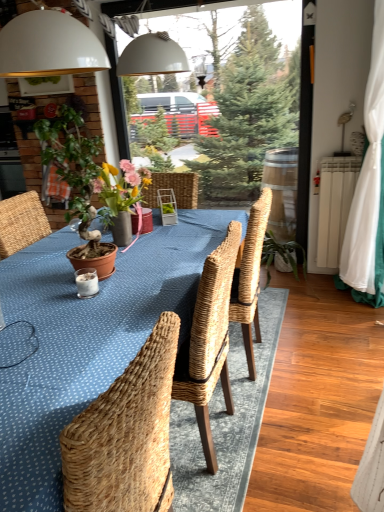
Question: Can you confirm if blue woven table at center is taller than white fabric curtain at right?

Choices:
 (A) yes
 (B) no

Answer: (B)

Question: Considering the relative sizes of blue woven table at center and white fabric curtain at right in the image provided, is blue woven table at center shorter than white fabric curtain at right?

Choices:
 (A) no
 (B) yes

Answer: (B)

Question: From the image's perspective, is blue woven table at center under white fabric curtain at right?

Choices:
 (A) no
 (B) yes

Answer: (B)

Question: Considering the relative sizes of blue woven table at center and white fabric curtain at right in the image provided, is blue woven table at center thinner than white fabric curtain at right?

Choices:
 (A) yes
 (B) no

Answer: (B)

Question: From the image's perspective, would you say blue woven table at center is positioned over white fabric curtain at right?

Choices:
 (A) no
 (B) yes

Answer: (A)

Question: Is blue woven table at center bigger than white fabric curtain at right?

Choices:
 (A) yes
 (B) no

Answer: (A)

Question: Is white fabric curtain at right facing towards blue woven table at center?

Choices:
 (A) no
 (B) yes

Answer: (A)

Question: From a real-world perspective, is white fabric curtain at right over blue woven table at center?

Choices:
 (A) yes
 (B) no

Answer: (A)

Question: Can you confirm if white fabric curtain at right is taller than blue woven table at center?

Choices:
 (A) no
 (B) yes

Answer: (B)

Question: Would you say white fabric curtain at right contains blue woven table at center?

Choices:
 (A) yes
 (B) no

Answer: (B)

Question: Considering the relative sizes of white fabric curtain at right and blue woven table at center in the image provided, is white fabric curtain at right smaller than blue woven table at center?

Choices:
 (A) no
 (B) yes

Answer: (B)

Question: Does white fabric curtain at right have a lesser height compared to blue woven table at center?

Choices:
 (A) yes
 (B) no

Answer: (B)

Question: Considering the relative positions of terracotta pot at left and white fabric curtain at right in the image provided, is terracotta pot at left in front of white fabric curtain at right?

Choices:
 (A) yes
 (B) no

Answer: (A)